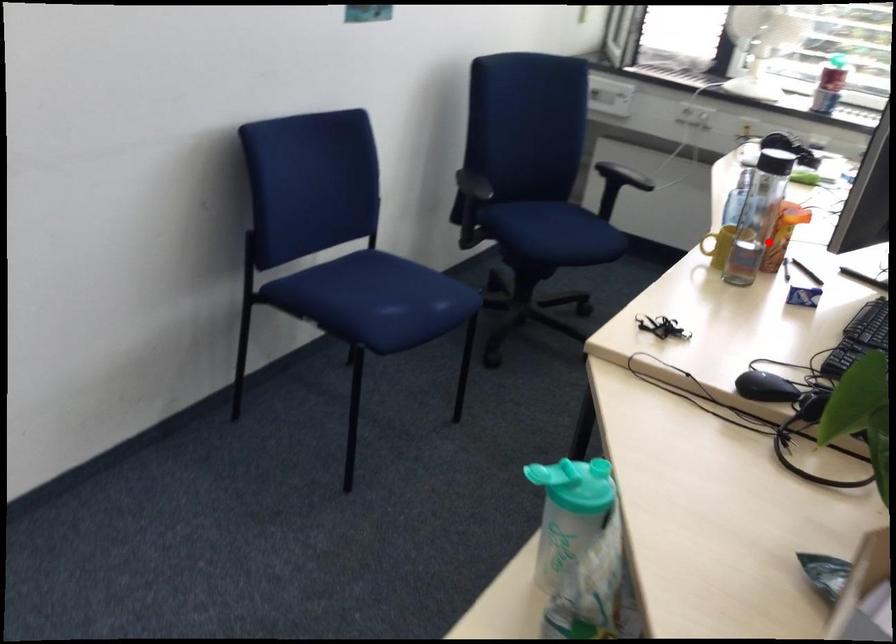
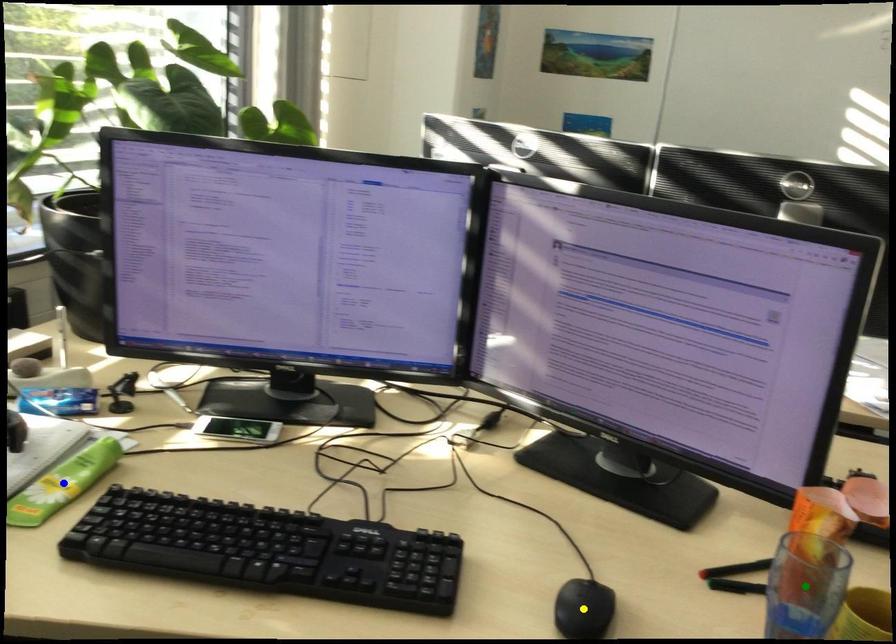
Question: I am providing you with two images of the same scene from different viewpoints. A red point is marked on the first image. You are given multiple points on the second image. Which spot in image 2 lines up with the point in image 1?

Choices:
 (A) green point
 (B) blue point
 (C) yellow point

Answer: (A)